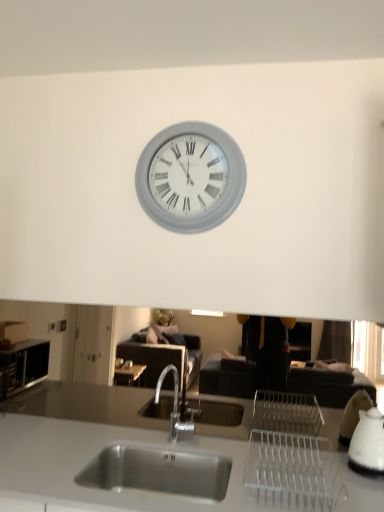
Question: Looking at their shapes, would you say white glossy kettle at right is wider or thinner than stainless steel sink at center?

Choices:
 (A) thin
 (B) wide

Answer: (A)

Question: From a real-world perspective, is white glossy kettle at right positioned above or below stainless steel sink at center?

Choices:
 (A) above
 (B) below

Answer: (A)

Question: Which object is positioned closest to the stainless steel sink at center?

Choices:
 (A) gray matte clock at upper center
 (B) white glossy kettle at right

Answer: (B)

Question: Which is farther from the gray matte clock at upper center?

Choices:
 (A) stainless steel sink at center
 (B) white glossy kettle at right

Answer: (B)